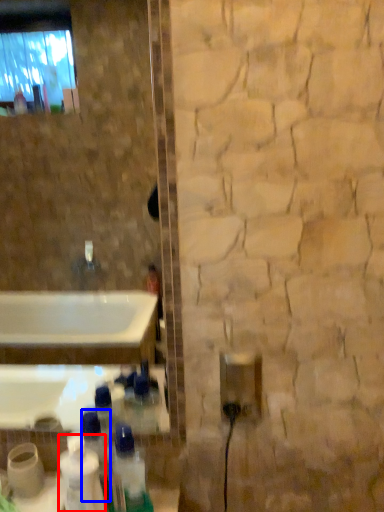
Question: Which object appears farthest to the camera in this image, cleaning product (highlighted by a red box) or bottle (highlighted by a blue box)?

Choices:
 (A) cleaning product
 (B) bottle

Answer: (B)